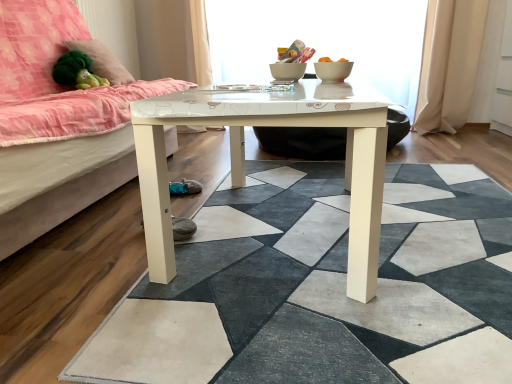
Image resolution: width=512 pixels, height=384 pixels. I want to click on free location above white glossy table at center (from a real-world perspective), so click(x=380, y=244).